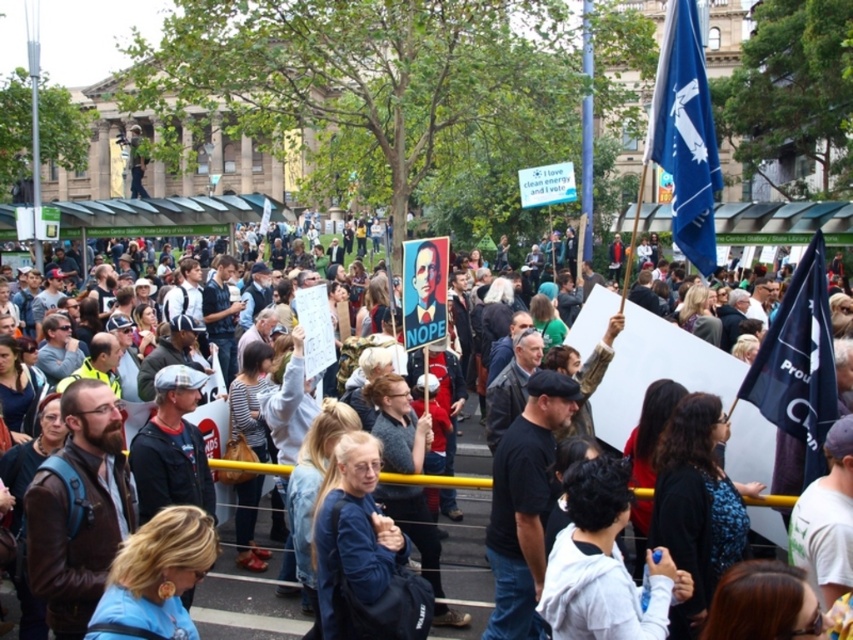
Question: Can you confirm if blue fabric flag at upper right is positioned above dark blue fabric flag at center-right?

Choices:
 (A) yes
 (B) no

Answer: (A)

Question: Which object is positioned closest to the dark blue fabric flag at center-right?

Choices:
 (A) white paper sign at center
 (B) blue fabric flag at upper right

Answer: (A)

Question: Does white paper sign at center have a smaller size compared to dark blue fabric flag at center-right?

Choices:
 (A) no
 (B) yes

Answer: (A)

Question: Which of the following is the farthest from the observer?

Choices:
 (A) (474, 608)
 (B) (675, 125)
 (C) (775, 381)

Answer: (B)

Question: Where is white paper sign at center located in relation to dark blue fabric flag at center-right in the image?

Choices:
 (A) left
 (B) right

Answer: (A)

Question: Which object is the closest to the blue fabric flag at upper right?

Choices:
 (A) dark blue fabric flag at center-right
 (B) white paper sign at center

Answer: (A)